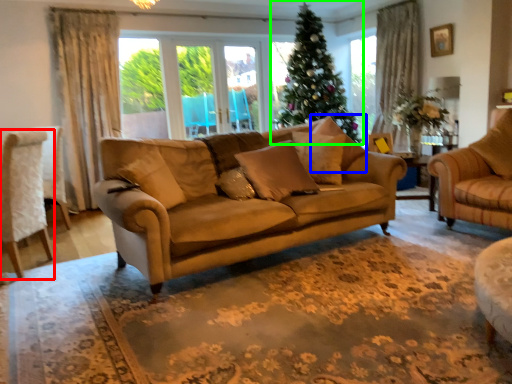
Question: Which is farther away from chair (highlighted by a red box)? pillow (highlighted by a blue box) or christmas tree (highlighted by a green box)?

Choices:
 (A) pillow
 (B) christmas tree

Answer: (B)